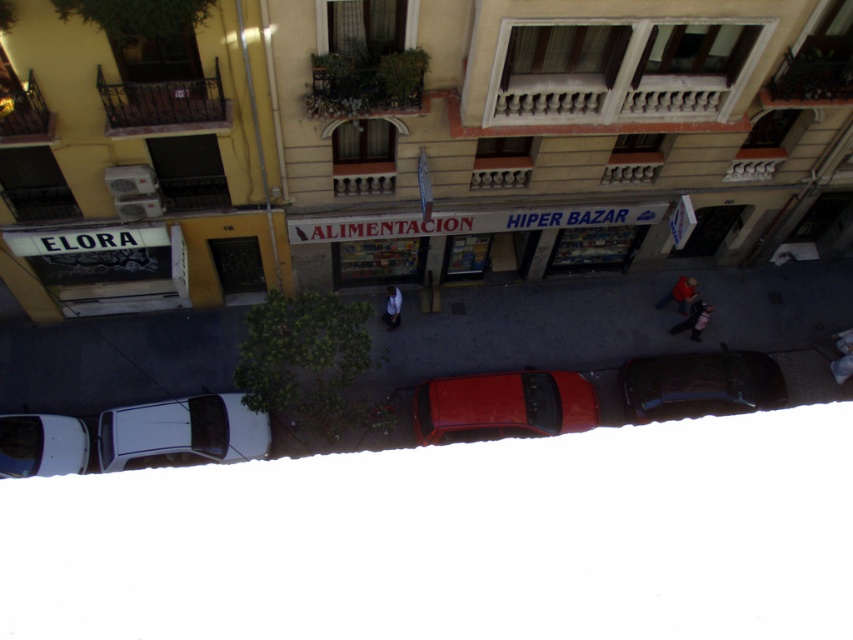
Question: Does shiny red car at center have a lesser width compared to shiny black car at lower right?

Choices:
 (A) no
 (B) yes

Answer: (A)

Question: Does shiny black car at lower right appear on the left side of matte red helmet at center?

Choices:
 (A) no
 (B) yes

Answer: (B)

Question: Estimate the real-world distances between objects in this image. Which object is closer to the light blue jeans at center?

Choices:
 (A) shiny red car at center
 (B) white glossy car at lower left
 (C) matte red helmet at center

Answer: (A)

Question: Among these objects, which one is farthest from the camera?

Choices:
 (A) dark gray fabric jacket at lower right
 (B) white glossy car at lower left
 (C) shiny red car at center
 (D) matte red helmet at center

Answer: (D)

Question: Which object is closer to the camera taking this photo?

Choices:
 (A) dark gray fabric jacket at lower right
 (B) light blue jeans at center
 (C) matte red helmet at center
 (D) shiny red car at center

Answer: (D)

Question: Can you confirm if shiny black car at lower right is positioned below dark gray fabric jacket at lower right?

Choices:
 (A) yes
 (B) no

Answer: (A)